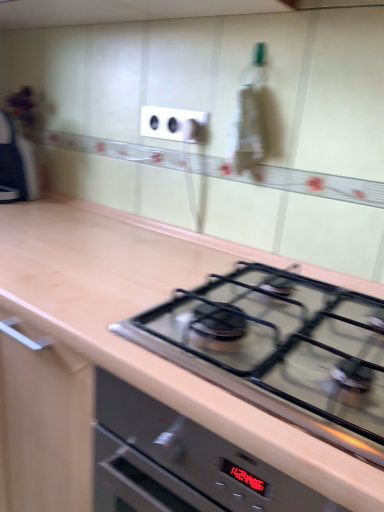
Question: Does satin black gas stove at center have a smaller size compared to white plastic electrical outlet at upper center?

Choices:
 (A) no
 (B) yes

Answer: (A)

Question: Can you confirm if satin black gas stove at center is thinner than white plastic electrical outlet at upper center?

Choices:
 (A) no
 (B) yes

Answer: (A)

Question: Is satin black gas stove at center not within white plastic electrical outlet at upper center?

Choices:
 (A) yes
 (B) no

Answer: (A)

Question: Does satin black gas stove at center have a greater width compared to white plastic electrical outlet at upper center?

Choices:
 (A) yes
 (B) no

Answer: (A)

Question: Is satin black gas stove at center far from white plastic electrical outlet at upper center?

Choices:
 (A) yes
 (B) no

Answer: (B)

Question: Considering the positions of point (198, 121) and point (211, 352), is point (198, 121) closer or farther from the camera than point (211, 352)?

Choices:
 (A) closer
 (B) farther

Answer: (B)

Question: Based on their sizes in the image, would you say matte black knob at upper center is bigger or smaller than satin black gas stove at center?

Choices:
 (A) small
 (B) big

Answer: (A)

Question: Considering the positions of matte black knob at upper center and satin black gas stove at center in the image, is matte black knob at upper center taller or shorter than satin black gas stove at center?

Choices:
 (A) short
 (B) tall

Answer: (B)

Question: From the image's perspective, is matte black knob at upper center located above or below satin black gas stove at center?

Choices:
 (A) below
 (B) above

Answer: (B)

Question: In terms of width, does white plastic electrical outlet at upper center look wider or thinner when compared to matte black knob at upper center?

Choices:
 (A) wide
 (B) thin

Answer: (B)

Question: Is white plastic electrical outlet at upper center situated inside matte black knob at upper center or outside?

Choices:
 (A) inside
 (B) outside

Answer: (B)

Question: In terms of size, does white plastic electrical outlet at upper center appear bigger or smaller than matte black knob at upper center?

Choices:
 (A) small
 (B) big

Answer: (B)

Question: Is point (165, 118) closer or farther from the camera than point (183, 138)?

Choices:
 (A) farther
 (B) closer

Answer: (A)

Question: In the image, is satin black gas stove at center on the left side or the right side of matte black knob at upper center?

Choices:
 (A) left
 (B) right

Answer: (B)

Question: Is satin black gas stove at center inside the boundaries of matte black knob at upper center, or outside?

Choices:
 (A) outside
 (B) inside

Answer: (A)